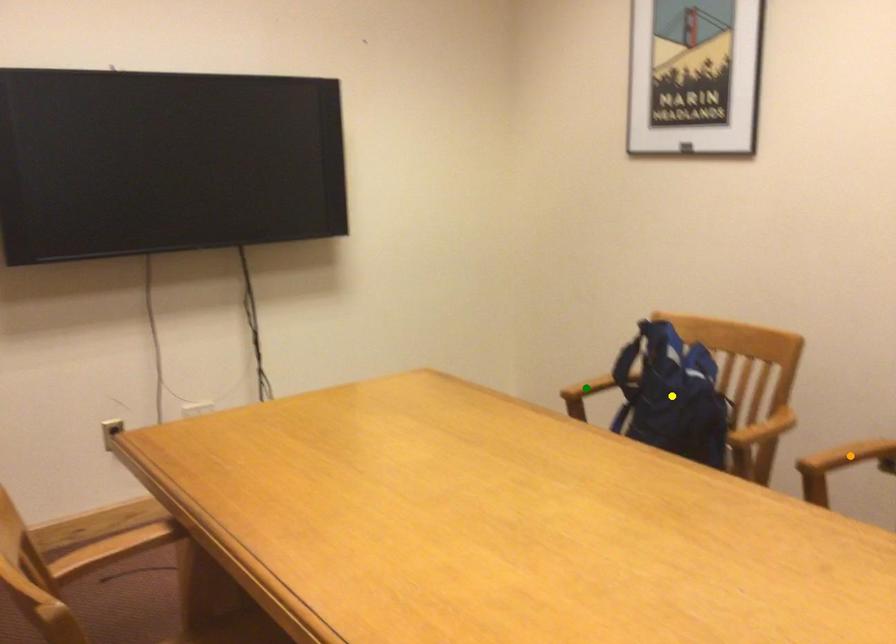
Order these from nearest to farthest:
orange point
yellow point
green point

1. orange point
2. yellow point
3. green point